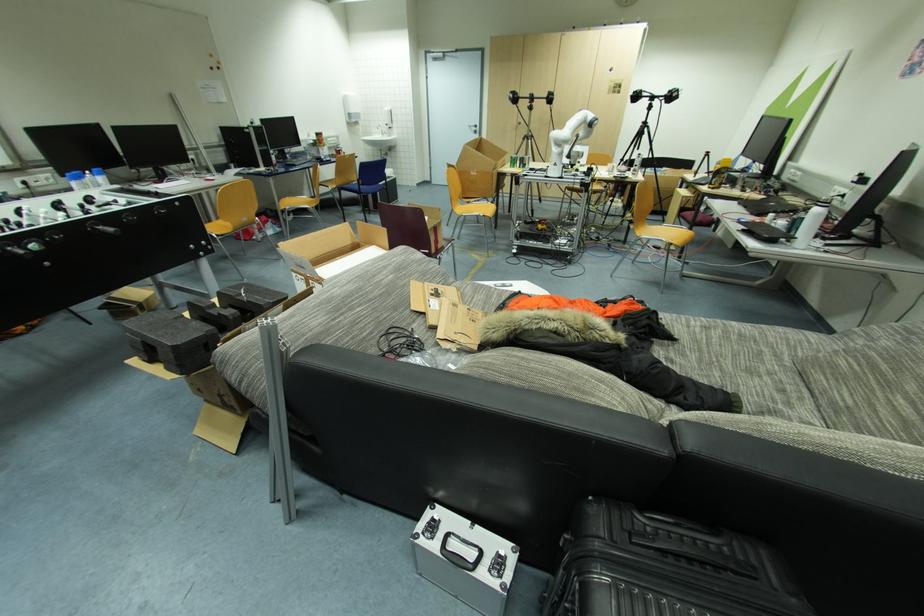
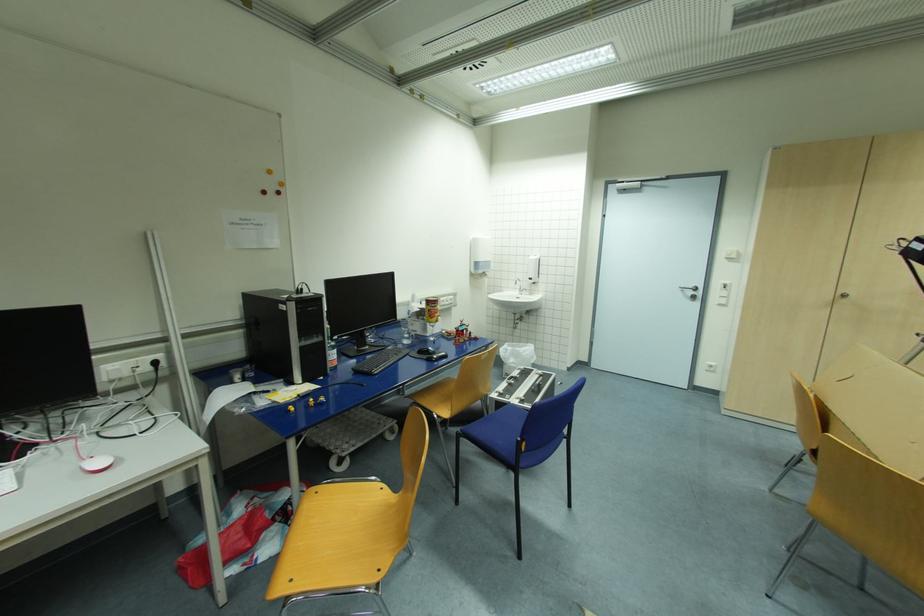
In the second image, find the point that corresponds to (x=479, y=127) in the first image.

(699, 289)